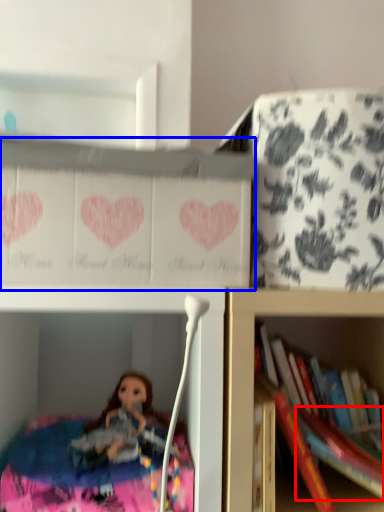
Question: Which object appears farthest to the camera in this image, book (highlighted by a red box) or cabinet (highlighted by a blue box)?

Choices:
 (A) book
 (B) cabinet

Answer: (A)